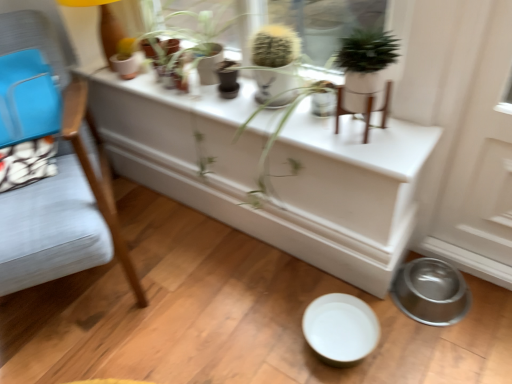
The image size is (512, 384). Identify the location of free space in front of metallic silver bowl at lower right. (453, 344).